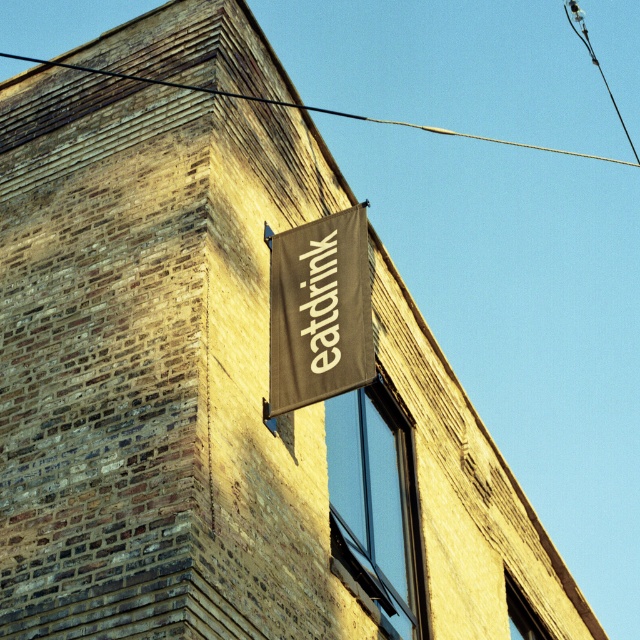
You are a window cleaner working on the side of the building. You need to clean the brown canvas sign at upper center and the black wire at upper center. Which object should you clean first if you start from the left side of the building?

You should clean the brown canvas sign at upper center first because it is to the left of the black wire at upper center.

You are a photographer standing in front of the brick building. You want to take a photo that focuses on the brown canvas sign at upper center without the black wire at upper center appearing in the foreground. Is this possible based on their positions?

The brown canvas sign at upper center is closer to the viewer than the black wire at upper center, so the sign will block the wire in the foreground, making it possible to focus on the sign without the wire appearing in front of it.

You are a maintenance worker inspecting the corner of the brick building. You notice the brown canvas sign at upper center and the black wire at upper center. Which object is positioned higher up in the scene?

The black wire at upper center is positioned higher up in the scene than the brown canvas sign at upper center.